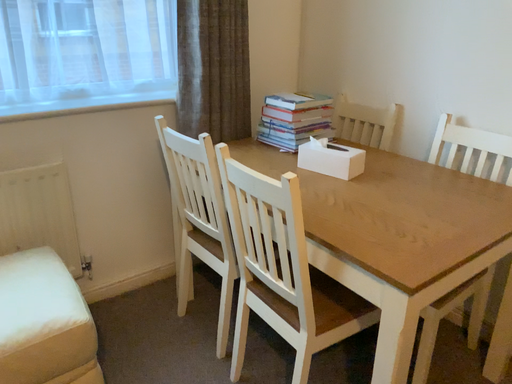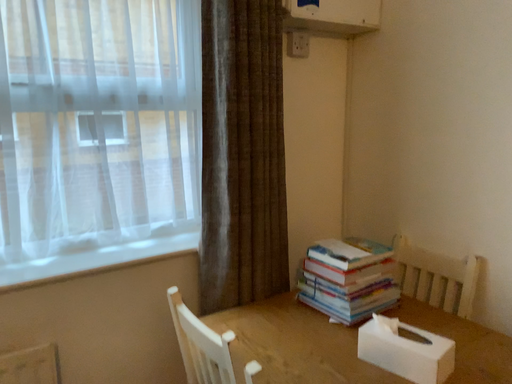
Question: Which way did the camera rotate in the video?

Choices:
 (A) rotated upward
 (B) rotated downward

Answer: (A)